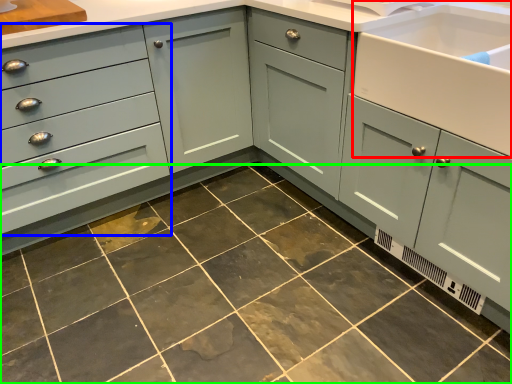
Question: Based on their relative distances, which object is nearer to sink (highlighted by a red box)? Choose from drawer (highlighted by a blue box) and ceramic tile (highlighted by a green box).

Choices:
 (A) drawer
 (B) ceramic tile

Answer: (B)